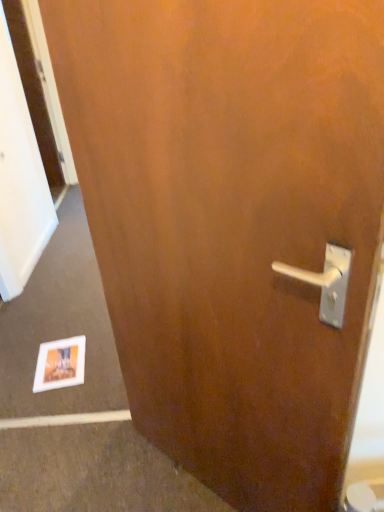
What do you see at coordinates (60, 364) in the screenshot?
I see `matte paper postcard at lower left` at bounding box center [60, 364].

In order to face matte paper postcard at lower left, should I rotate leftwards or rightwards?

A 17.042 degree turn to the left will do.

In order to click on matte paper postcard at lower left in this screenshot , I will do `click(60, 364)`.

What do you see at coordinates (19, 180) in the screenshot? I see `wooden screen door at left` at bounding box center [19, 180].

The image size is (384, 512). I want to click on wooden screen door at left, so click(x=19, y=180).

The height and width of the screenshot is (512, 384). I want to click on matte paper postcard at lower left, so click(x=60, y=364).

Considering the relative positions of wooden screen door at left and matte paper postcard at lower left in the image provided, is wooden screen door at left to the left or to the right of matte paper postcard at lower left?

In the image, wooden screen door at left appears on the left side of matte paper postcard at lower left.

Considering their positions, is wooden screen door at left located in front of or behind matte paper postcard at lower left?

In the image, wooden screen door at left appears behind matte paper postcard at lower left.

Is point (11, 160) closer to viewer compared to point (47, 368)?

No, it is not.

From the picture: From the image's perspective, is wooden screen door at left positioned above or below matte paper postcard at lower left?

From the image's perspective, wooden screen door at left appears above matte paper postcard at lower left.

From a real-world perspective, is wooden screen door at left positioned above or below matte paper postcard at lower left?

Clearly, from a real-world perspective, wooden screen door at left is above matte paper postcard at lower left.

Can you confirm if wooden screen door at left is wider than matte paper postcard at lower left?

No.

Is wooden screen door at left shorter than matte paper postcard at lower left?

Incorrect, the height of wooden screen door at left does not fall short of that of matte paper postcard at lower left.

Can you confirm if wooden screen door at left is bigger than matte paper postcard at lower left?

Yes, wooden screen door at left is bigger than matte paper postcard at lower left.

Is matte paper postcard at lower left surrounded by wooden screen door at left?

No, matte paper postcard at lower left is not inside wooden screen door at left.

Are wooden screen door at left and matte paper postcard at lower left located far from each other?

No, wooden screen door at left is not far from matte paper postcard at lower left.

Is wooden screen door at left positioned with its back to matte paper postcard at lower left?

That's not correct — wooden screen door at left is not looking away from matte paper postcard at lower left.

How much distance is there between wooden screen door at left and matte paper postcard at lower left?

wooden screen door at left is 36.52 inches from matte paper postcard at lower left.

The image size is (384, 512). What are the coordinates of `postcard that is on the right side of wooden screen door at left` in the screenshot? It's located at pos(60,364).

Would you say matte paper postcard at lower left is to the left or to the right of wooden screen door at left in the picture?

matte paper postcard at lower left is to the right of wooden screen door at left.

Is matte paper postcard at lower left in front of or behind wooden screen door at left in the image?

matte paper postcard at lower left is in front of wooden screen door at left.

Does point (40, 389) come closer to viewer compared to point (9, 124)?

Yes, point (40, 389) is in front of point (9, 124).

From the image's perspective, which one is positioned higher, matte paper postcard at lower left or wooden screen door at left?

wooden screen door at left, from the image's perspective.

From a real-world perspective, does matte paper postcard at lower left stand above wooden screen door at left?

Incorrect, from a real-world perspective, matte paper postcard at lower left is lower than wooden screen door at left.

Between matte paper postcard at lower left and wooden screen door at left, which one has larger width?

matte paper postcard at lower left is wider.

From their relative heights in the image, would you say matte paper postcard at lower left is taller or shorter than wooden screen door at left?

In the image, matte paper postcard at lower left appears to be shorter than wooden screen door at left.

Does matte paper postcard at lower left have a smaller size compared to wooden screen door at left?

Correct, matte paper postcard at lower left occupies less space than wooden screen door at left.

Do you think matte paper postcard at lower left is within wooden screen door at left, or outside of it?

matte paper postcard at lower left cannot be found inside wooden screen door at left.

Is matte paper postcard at lower left next to wooden screen door at left?

No, matte paper postcard at lower left is not making contact with wooden screen door at left.

Is matte paper postcard at lower left oriented towards wooden screen door at left?

No.

How far apart are matte paper postcard at lower left and wooden screen door at left?

The distance of matte paper postcard at lower left from wooden screen door at left is 36.52 inches.

Find the location of `postcard that appears in front of the wooden screen door at left`. postcard that appears in front of the wooden screen door at left is located at coordinates (60, 364).

The image size is (384, 512). In order to click on screen door above the matte paper postcard at lower left (from the image's perspective) in this screenshot , I will do `click(19, 180)`.

The width and height of the screenshot is (384, 512). I want to click on screen door that is on the left side of matte paper postcard at lower left, so click(x=19, y=180).